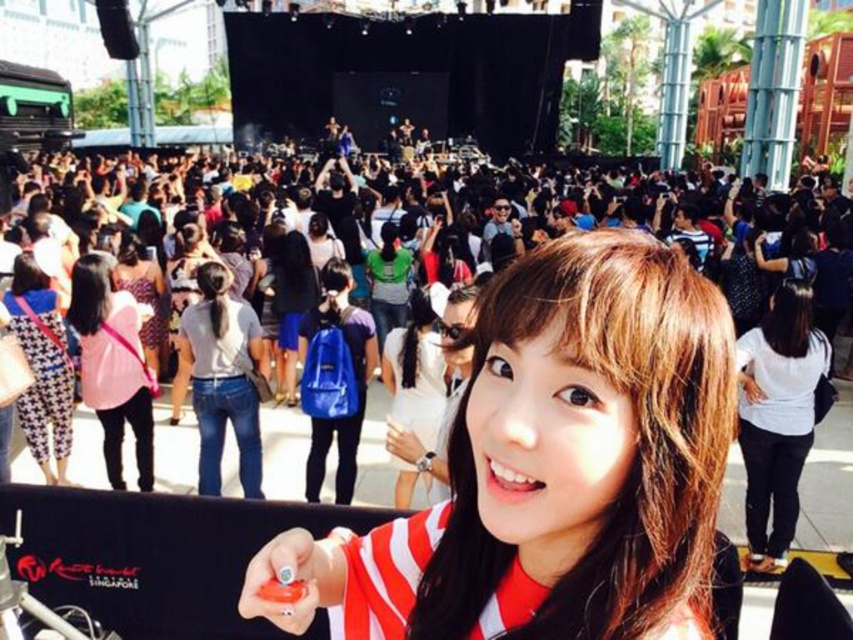
You are at the concert and want to place your pink fabric bag at center on the ground next to the matte black crowd at center. Will the crowd block the bag from view?

The matte black crowd at center is larger in size than pink fabric bag at center, so the crowd will likely block the bag from view.

From the picture: You are at the concert and want to take a photo of the person wearing the matte red striped shirt at center. Where should you aim your camera?

You should aim your camera at point (553, 467) to capture the matte red striped shirt at center.

You are at an outdoor concert and see two people in front of you wearing shirts. One is wearing a matte red striped shirt at center and the other a white cotton shirt at center. Which shirt is located to the right of the other?

The matte red striped shirt at center is positioned on the right side of white cotton shirt at center.